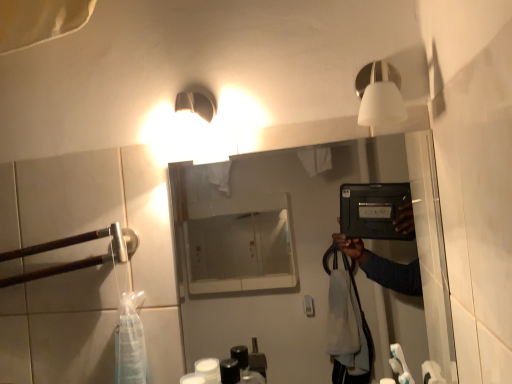
Question: Is matte black tablet at center facing towards white matte light fixture at upper right?

Choices:
 (A) yes
 (B) no

Answer: (B)

Question: Can you confirm if matte black tablet at center is smaller than white matte light fixture at upper right?

Choices:
 (A) yes
 (B) no

Answer: (B)

Question: From the image's perspective, would you say matte black tablet at center is shown under white matte light fixture at upper right?

Choices:
 (A) no
 (B) yes

Answer: (B)

Question: Is matte black tablet at center further to the viewer compared to white matte light fixture at upper right?

Choices:
 (A) no
 (B) yes

Answer: (B)

Question: Would you consider matte black tablet at center to be distant from white matte light fixture at upper right?

Choices:
 (A) yes
 (B) no

Answer: (A)

Question: Is white matte light fixture at upper right inside or outside of matte black tablet at center?

Choices:
 (A) outside
 (B) inside

Answer: (A)

Question: From a real-world perspective, is white matte light fixture at upper right above or below matte black tablet at center?

Choices:
 (A) above
 (B) below

Answer: (A)

Question: Relative to matte black tablet at center, is white matte light fixture at upper right in front or behind?

Choices:
 (A) front
 (B) behind

Answer: (A)

Question: Would you say white matte light fixture at upper right is to the left or to the right of matte black tablet at center in the picture?

Choices:
 (A) right
 (B) left

Answer: (A)

Question: In the image, is matte black tablet at center positioned in front of or behind brown wood at left?

Choices:
 (A) front
 (B) behind

Answer: (A)

Question: Is point (311, 349) closer or farther from the camera than point (77, 243)?

Choices:
 (A) closer
 (B) farther

Answer: (B)

Question: In terms of width, does matte black tablet at center look wider or thinner when compared to brown wood at left?

Choices:
 (A) thin
 (B) wide

Answer: (A)

Question: From the image's perspective, is matte black tablet at center positioned above or below brown wood at left?

Choices:
 (A) below
 (B) above

Answer: (B)

Question: Is brown wood at left to the left or to the right of matte black tablet at center in the image?

Choices:
 (A) left
 (B) right

Answer: (A)

Question: From the image's perspective, relative to matte black tablet at center, is brown wood at left above or below?

Choices:
 (A) below
 (B) above

Answer: (A)